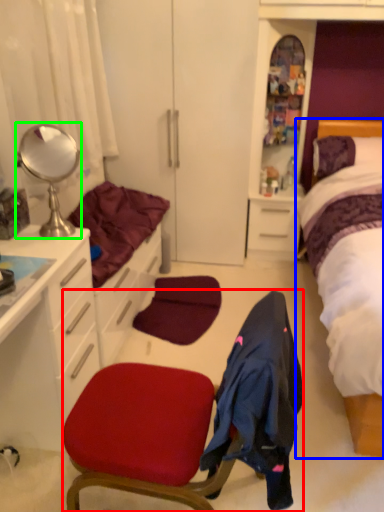
Question: Which object is positioned closest to chair (highlighted by a red box)? Select from bed (highlighted by a blue box) and mirror (highlighted by a green box).

Choices:
 (A) bed
 (B) mirror

Answer: (B)